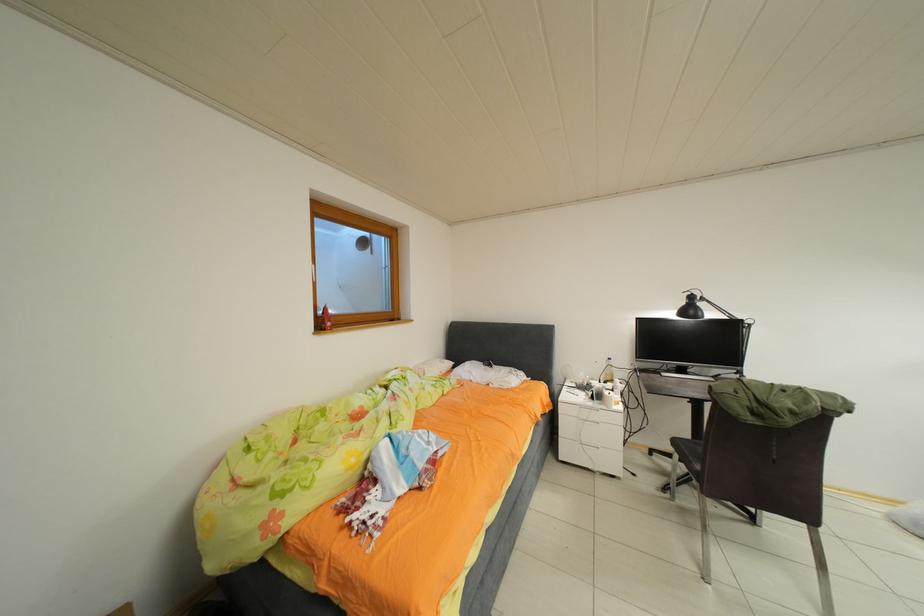
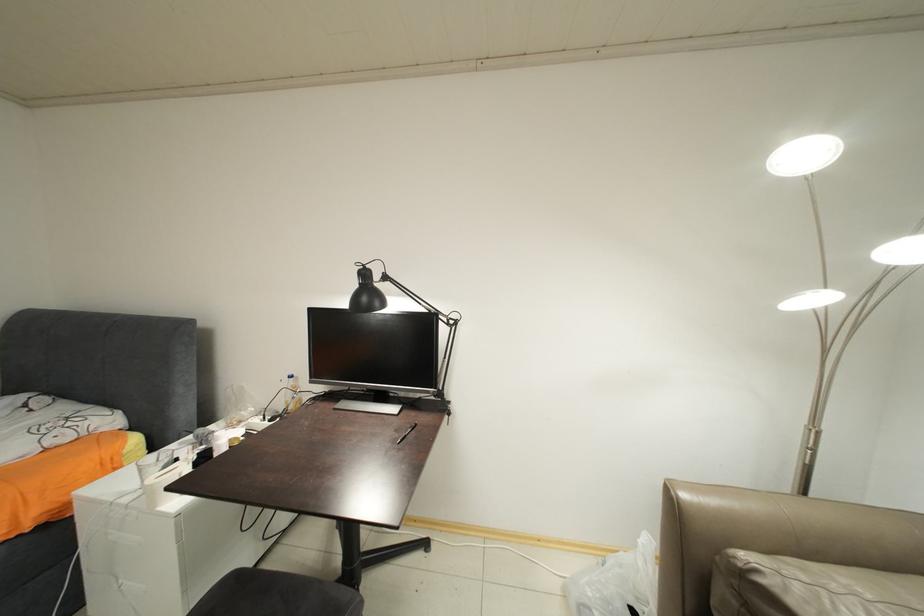
In a continuous first-person perspective shot, in which direction is the camera moving?

The cameraman moved toward right, forward.